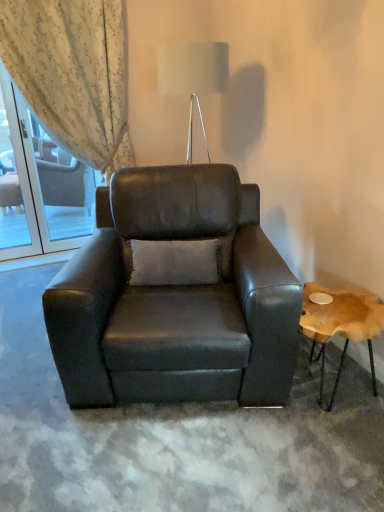
Question: Could you tell me if clear glass screen door at upper left is turned towards wooden natural stool at right?

Choices:
 (A) yes
 (B) no

Answer: (B)

Question: From the image's perspective, is clear glass screen door at upper left above wooden natural stool at right?

Choices:
 (A) yes
 (B) no

Answer: (A)

Question: Is clear glass screen door at upper left wider than wooden natural stool at right?

Choices:
 (A) yes
 (B) no

Answer: (B)

Question: Does clear glass screen door at upper left have a greater height compared to wooden natural stool at right?

Choices:
 (A) no
 (B) yes

Answer: (B)

Question: Is there a large distance between clear glass screen door at upper left and wooden natural stool at right?

Choices:
 (A) yes
 (B) no

Answer: (A)

Question: Does clear glass screen door at upper left appear on the left side of wooden natural stool at right?

Choices:
 (A) yes
 (B) no

Answer: (A)

Question: Considering the relative positions of wooden natural stool at right and clear glass screen door at upper left in the image provided, is wooden natural stool at right to the right of clear glass screen door at upper left from the viewer's perspective?

Choices:
 (A) yes
 (B) no

Answer: (A)

Question: Is wooden natural stool at right further to camera compared to clear glass screen door at upper left?

Choices:
 (A) no
 (B) yes

Answer: (A)

Question: From the image's perspective, is wooden natural stool at right on top of clear glass screen door at upper left?

Choices:
 (A) no
 (B) yes

Answer: (A)

Question: Is wooden natural stool at right positioned far away from clear glass screen door at upper left?

Choices:
 (A) yes
 (B) no

Answer: (A)

Question: From the image's perspective, is wooden natural stool at right below clear glass screen door at upper left?

Choices:
 (A) no
 (B) yes

Answer: (B)

Question: Is wooden natural stool at right next to clear glass screen door at upper left and touching it?

Choices:
 (A) yes
 (B) no

Answer: (B)

Question: Is clear glass screen door at upper left wider than light beige textured curtain at upper left?

Choices:
 (A) yes
 (B) no

Answer: (B)